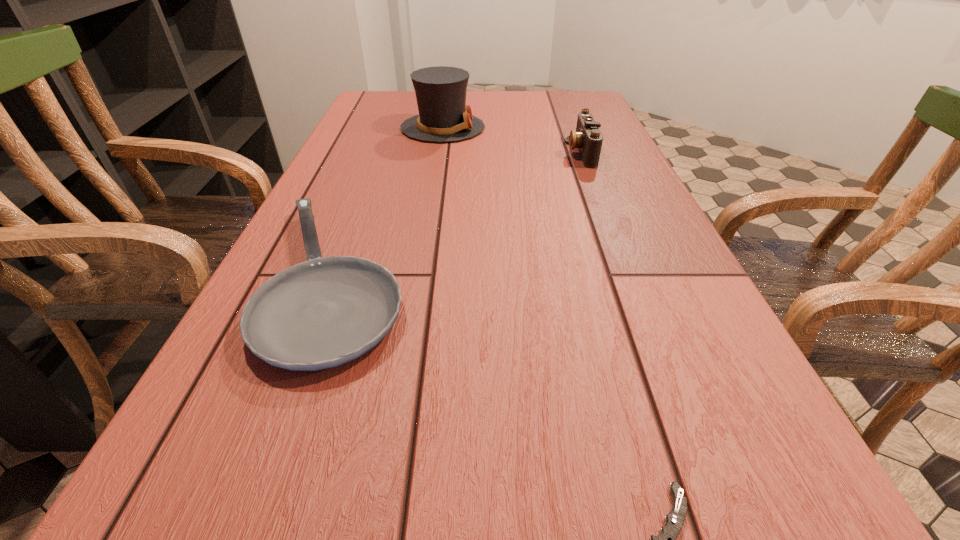
The width and height of the screenshot is (960, 540). Find the location of `dress hat that is at the left edge`. dress hat that is at the left edge is located at coordinates (440, 91).

Locate an element on the screen. This screenshot has height=540, width=960. frying pan at the left edge is located at coordinates (324, 312).

This screenshot has height=540, width=960. Find the location of `object located at the right edge`. object located at the right edge is located at coordinates (588, 139).

Locate an element on the screen. Image resolution: width=960 pixels, height=540 pixels. object that is at the far left corner is located at coordinates (440, 91).

The width and height of the screenshot is (960, 540). I want to click on vacant area at the far edge, so click(516, 93).

Identify the location of vacant space at the left edge of the desktop. This screenshot has height=540, width=960. (322, 376).

The image size is (960, 540). In the image, there is a desktop. Identify the location of vacant space at the right edge. (611, 139).

You are a GUI agent. You are given a task and a screenshot of the screen. Output one action in this format:
    pyautogui.click(x=<x>, y=<y>)
    Task: Click on the vacant area at the far left corner of the desktop
    This screenshot has height=540, width=960.
    Given the screenshot: What is the action you would take?
    pyautogui.click(x=413, y=98)

Find the location of `free space at the far right corner`. free space at the far right corner is located at coordinates (563, 117).

The width and height of the screenshot is (960, 540). Identify the location of vacant area between the camera and the second shortest object. (459, 216).